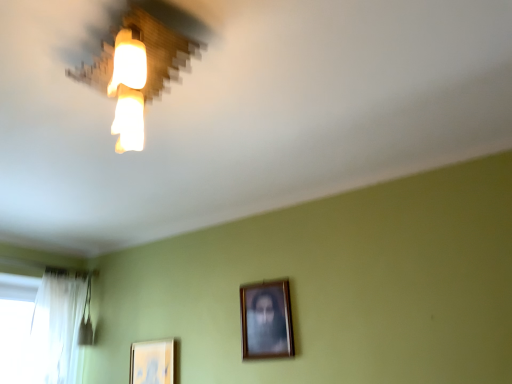
Question: From the image's perspective, is wooden lampshade at upper left located above white sheer curtain at left?

Choices:
 (A) yes
 (B) no

Answer: (A)

Question: Would you say wooden lampshade at upper left is a long distance from white sheer curtain at left?

Choices:
 (A) yes
 (B) no

Answer: (A)

Question: Is wooden lampshade at upper left positioned before white sheer curtain at left?

Choices:
 (A) no
 (B) yes

Answer: (B)

Question: Does wooden lampshade at upper left have a larger size compared to white sheer curtain at left?

Choices:
 (A) no
 (B) yes

Answer: (A)

Question: Does wooden lampshade at upper left turn towards white sheer curtain at left?

Choices:
 (A) no
 (B) yes

Answer: (A)

Question: From the image's perspective, is white sheer curtain at left positioned above or below wooden framed portrait at center, the 2th picture frame positioned from the back?

Choices:
 (A) below
 (B) above

Answer: (A)

Question: Is point (23, 316) positioned closer to the camera than point (266, 344)?

Choices:
 (A) farther
 (B) closer

Answer: (A)

Question: Considering the relative positions of white sheer curtain at left and wooden framed portrait at center, the 1th picture frame when ordered from right to left, in the image provided, is white sheer curtain at left to the left or to the right of wooden framed portrait at center, the 1th picture frame when ordered from right to left,?

Choices:
 (A) left
 (B) right

Answer: (A)

Question: Do you think white sheer curtain at left is within wooden framed portrait at center, the 1th picture frame when ordered from right to left, or outside of it?

Choices:
 (A) inside
 (B) outside

Answer: (B)

Question: Considering their positions, is wooden lampshade at upper left located in front of or behind wooden framed portrait at center, the 2th picture frame positioned from the back?

Choices:
 (A) behind
 (B) front

Answer: (B)

Question: Considering the positions of wooden lampshade at upper left and wooden framed portrait at center, the 2th picture frame positioned from the back, in the image, is wooden lampshade at upper left bigger or smaller than wooden framed portrait at center, the 2th picture frame positioned from the back,?

Choices:
 (A) small
 (B) big

Answer: (B)

Question: Is wooden lampshade at upper left taller or shorter than wooden framed portrait at center, which is the 2th picture frame from bottom to top?

Choices:
 (A) short
 (B) tall

Answer: (A)

Question: Based on their positions, is wooden lampshade at upper left located to the left or right of wooden framed portrait at center, the 2th picture frame positioned from the back?

Choices:
 (A) left
 (B) right

Answer: (A)

Question: Choose the correct answer: Is wooden framed portrait at center, the 1th picture frame when ordered from right to left, inside matte white picture frame at lower left, which is the first picture frame from left to right, or outside it?

Choices:
 (A) outside
 (B) inside

Answer: (A)

Question: From a real-world perspective, is wooden framed portrait at center, the 2th picture frame positioned from the back, positioned above or below matte white picture frame at lower left, placed as the second picture frame when sorted from top to bottom?

Choices:
 (A) below
 (B) above

Answer: (B)